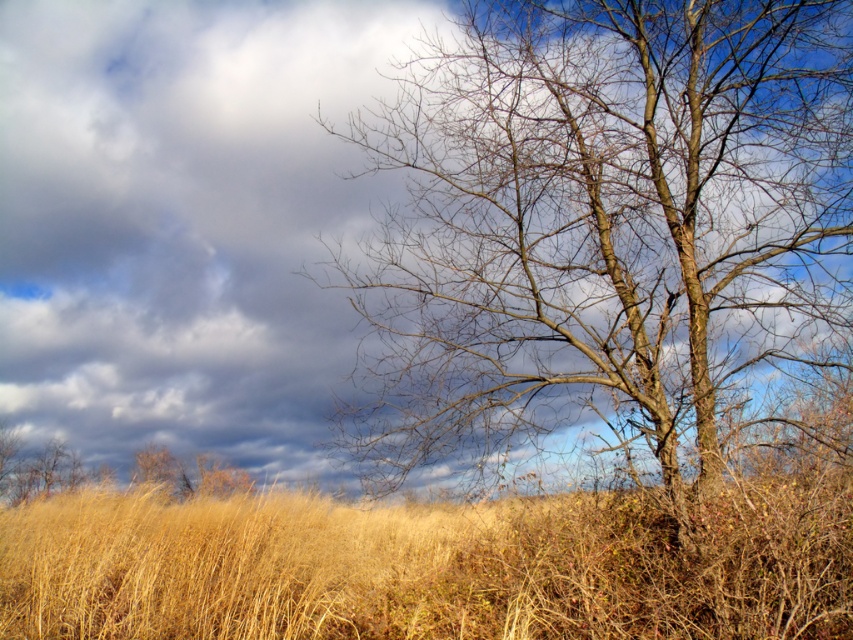
Based on the photo, you are a hiker trying to navigate through the dry grass at center. There is a bark textured tree at right nearby. Which direction should you walk to avoid the tree?

The bark textured tree at right is positioned over dry grass at center, so you should walk away from the direction of the tree to avoid it.

You are standing at the center of the field of tall, golden brown grasses in the foreground. If you want to walk directly towards the bark textured tree at right, which direction should you head?

You should head to the right because the bark textured tree at right is located at point 0.348 on the x axis, which is to the right of the center point at 0.5. However, since the tree is at 0.348, which is actually to the left of the center, the correct direction would be to the left. Wait, there might be a mistake here. Let me recalculate. If the coordinates are normalized between 0 and 1, with 0 being the left edge and 1 the right edge, then 0.348 is indeed to the left of the center at 0.5. Therefore, the

You are an artist planning to paint the scene. You want to emphasize the contrast between the bark textured tree at right and the dry grass at center. Which object should you make wider to highlight their size difference?

To highlight the size difference between the bark textured tree at right and the dry grass at center, you should make the dry grass at center wider since it is already wider than the bark textured tree at right according to the description.